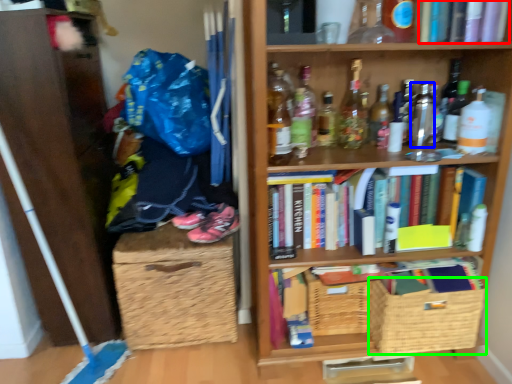
Question: Based on their relative distances, which object is farther from book (highlighted by a red box)? Choose from bottle (highlighted by a blue box) and basket (highlighted by a green box).

Choices:
 (A) bottle
 (B) basket

Answer: (B)